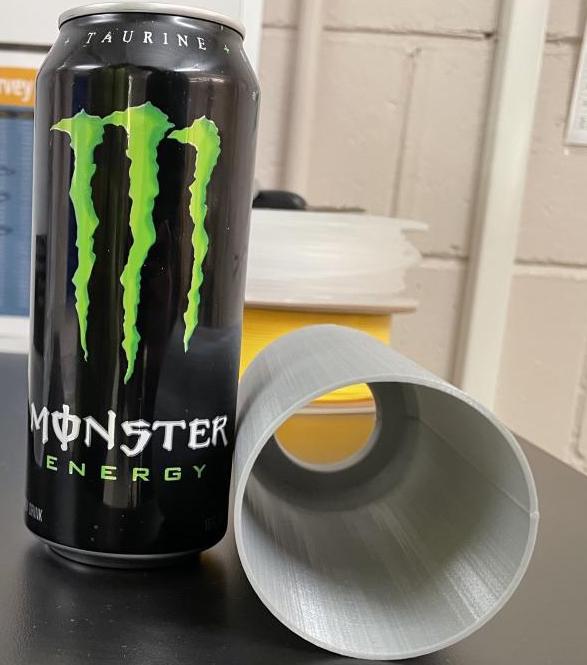
In order to click on white board in this screenshot , I will do `click(26, 11)`.